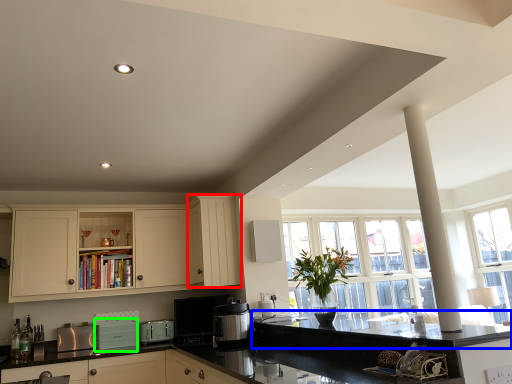
Question: Estimate the real-world distances between objects in this image. Which object is closer to cabinetry (highlighted by a red box), countertop (highlighted by a blue box) or appliance (highlighted by a green box)?

Choices:
 (A) countertop
 (B) appliance

Answer: (A)